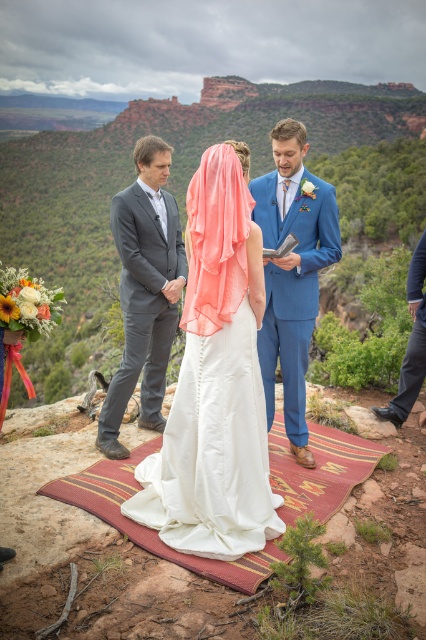
From the picture: You are planning to store the blue satin suit at center and the dark blue jeans at lower right in a wardrobe. Given their sizes, which one will require more space in the wardrobe?

The dark blue jeans at lower right require more space in the wardrobe because the blue satin suit at center occupies less space than dark blue jeans at lower right.

You are a photographer at the wedding ceremony. You need to position yourself so that both the blue satin suit at center and the dark blue jeans at lower right are in frame. Which object should you focus on first to ensure both are visible?

You should focus on the dark blue jeans at lower right first because the blue satin suit at center is shorter than it, so adjusting the frame to include the taller dark blue jeans at lower right will automatically include the shorter blue satin suit at center.